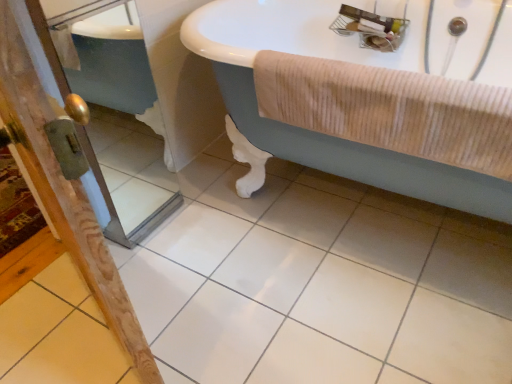
Question: Can you confirm if wooden screen door at lower left, placed as the first screen door when sorted from right to left, is thinner than beige corduroy towel at right?

Choices:
 (A) no
 (B) yes

Answer: (A)

Question: From the image's perspective, is wooden screen door at lower left, the second screen door from the left, above beige corduroy towel at right?

Choices:
 (A) yes
 (B) no

Answer: (A)

Question: Is wooden screen door at lower left, placed as the first screen door when sorted from right to left, smaller than beige corduroy towel at right?

Choices:
 (A) no
 (B) yes

Answer: (A)

Question: Considering the relative sizes of wooden screen door at lower left, the second screen door from the left, and beige corduroy towel at right in the image provided, is wooden screen door at lower left, the second screen door from the left, shorter than beige corduroy towel at right?

Choices:
 (A) no
 (B) yes

Answer: (A)

Question: Considering the relative positions of wooden screen door at lower left, placed as the first screen door when sorted from right to left, and beige corduroy towel at right in the image provided, is wooden screen door at lower left, placed as the first screen door when sorted from right to left, behind beige corduroy towel at right?

Choices:
 (A) yes
 (B) no

Answer: (A)

Question: Does wooden screen door at lower left, placed as the first screen door when sorted from right to left, appear on the left side of beige corduroy towel at right?

Choices:
 (A) no
 (B) yes

Answer: (B)

Question: Is white glossy bathtub at upper center at the left side of white glossy tile at center?

Choices:
 (A) yes
 (B) no

Answer: (B)

Question: From a real-world perspective, is white glossy bathtub at upper center beneath white glossy tile at center?

Choices:
 (A) yes
 (B) no

Answer: (B)

Question: Is white glossy tile at center at the back of white glossy bathtub at upper center?

Choices:
 (A) yes
 (B) no

Answer: (B)

Question: Are white glossy bathtub at upper center and white glossy tile at center far apart?

Choices:
 (A) yes
 (B) no

Answer: (B)

Question: Is white glossy bathtub at upper center shorter than white glossy tile at center?

Choices:
 (A) no
 (B) yes

Answer: (A)

Question: Does white glossy bathtub at upper center have a larger size compared to white glossy tile at center?

Choices:
 (A) no
 (B) yes

Answer: (B)

Question: Is white glossy tile at center not close to wooden screen door at left, the first screen door positioned from the left?

Choices:
 (A) no
 (B) yes

Answer: (A)